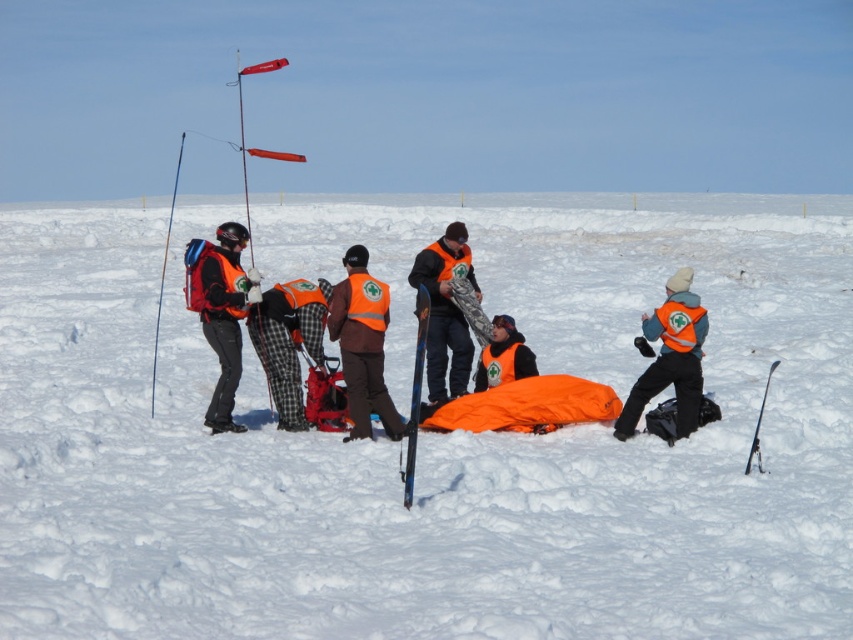
Question: In this image, where is brown fabric jacket at center located relative to orange reflective vest at center?

Choices:
 (A) left
 (B) right

Answer: (A)

Question: Observing the image, what is the correct spatial positioning of orange fabric at center in reference to orange reflective vest at center?

Choices:
 (A) right
 (B) left

Answer: (A)

Question: Which point is closer to the camera?

Choices:
 (A) (537, 472)
 (B) (213, 394)
 (C) (511, 368)

Answer: (A)

Question: Among these objects, which one is nearest to the camera?

Choices:
 (A) orange fleece jacket at center
 (B) matte orange vest at left
 (C) orange reflective vest at center

Answer: (C)

Question: Can you confirm if orange fabric at center is positioned above orange reflective vest at center?

Choices:
 (A) no
 (B) yes

Answer: (B)

Question: Among these objects, which one is farthest from the camera?

Choices:
 (A) brown fabric jacket at center
 (B) matte orange vest at left

Answer: (B)